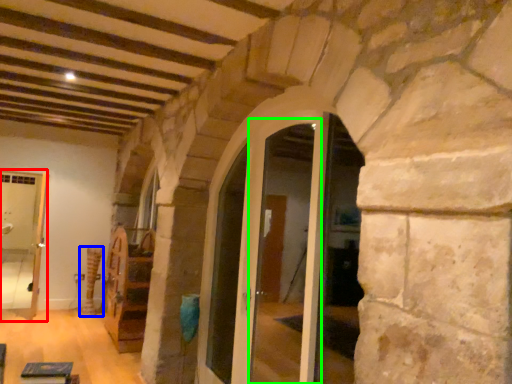
Question: Which object is the closest to the passage (highlighted by a red box)? Choose among these: pillar (highlighted by a blue box) or glass door (highlighted by a green box).

Choices:
 (A) pillar
 (B) glass door

Answer: (A)